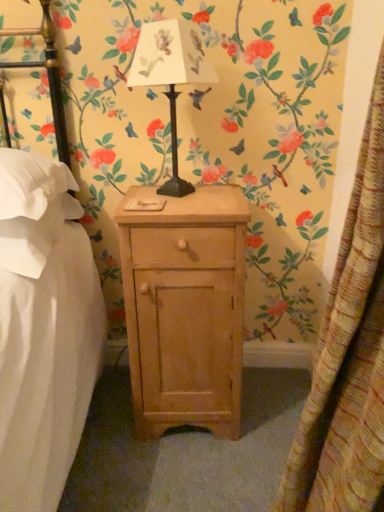
What do you see at coordinates (35, 236) in the screenshot? I see `white fabric pillow at left, acting as the 1th pillow starting from the bottom` at bounding box center [35, 236].

Image resolution: width=384 pixels, height=512 pixels. What do you see at coordinates (348, 356) in the screenshot?
I see `textured yellow curtain at right` at bounding box center [348, 356].

The height and width of the screenshot is (512, 384). What do you see at coordinates (170, 76) in the screenshot?
I see `metallic black table lamp at center` at bounding box center [170, 76].

This screenshot has height=512, width=384. What are the coordinates of `light wood nightstand at center` in the screenshot? It's located at click(185, 308).

Considering the sizes of white fabric pillow at left, the 2th pillow in the top-to-bottom sequence, and metallic black table lamp at center in the image, is white fabric pillow at left, the 2th pillow in the top-to-bottom sequence, bigger or smaller than metallic black table lamp at center?

Considering their sizes, white fabric pillow at left, the 2th pillow in the top-to-bottom sequence, takes up more space than metallic black table lamp at center.

Is white fabric pillow at left, acting as the 1th pillow starting from the bottom, facing away from metallic black table lamp at center?

white fabric pillow at left, acting as the 1th pillow starting from the bottom, does not have its back to metallic black table lamp at center.

Between white fabric pillow at left, the 2th pillow in the top-to-bottom sequence, and metallic black table lamp at center, which one is positioned in front?

Positioned in front is metallic black table lamp at center.

Which point is more distant from viewer, (155,234) or (171,100)?

The point (171,100) is farther from the camera.

Consider the image. Is light wood nightstand at center wider than metallic black table lamp at center?

Yes, light wood nightstand at center is wider than metallic black table lamp at center.

Is light wood nightstand at center positioned with its back to metallic black table lamp at center?

light wood nightstand at center does not have its back to metallic black table lamp at center.

From a real-world perspective, which object stands above the other?

metallic black table lamp at center.

Can you see white fabric pillow at left, acting as the 1th pillow starting from the bottom, touching light wood nightstand at center?

No, white fabric pillow at left, acting as the 1th pillow starting from the bottom, is not making contact with light wood nightstand at center.

Is white fabric pillow at left, the 2th pillow in the top-to-bottom sequence, taller than light wood nightstand at center?

In fact, white fabric pillow at left, the 2th pillow in the top-to-bottom sequence, may be shorter than light wood nightstand at center.

Is white fabric pillow at left, the 2th pillow in the top-to-bottom sequence, oriented towards light wood nightstand at center?

No.

Which of these two, white soft pillow at left, the 2th pillow from the bottom, or textured yellow curtain at right, is wider?

With larger width is white soft pillow at left, the 2th pillow from the bottom.

Looking at this image, does white soft pillow at left, the 2th pillow from the bottom, turn towards textured yellow curtain at right?

No, white soft pillow at left, the 2th pillow from the bottom, does not turn towards textured yellow curtain at right.

Could you measure the distance between white soft pillow at left, the 2th pillow from the bottom, and textured yellow curtain at right?

white soft pillow at left, the 2th pillow from the bottom, and textured yellow curtain at right are 32.49 inches apart from each other.

From the image's perspective, is white soft pillow at left, marked as the 1th pillow in a top-to-bottom arrangement, below textured yellow curtain at right?

Actually, white soft pillow at left, marked as the 1th pillow in a top-to-bottom arrangement, appears above textured yellow curtain at right in the image.

From the image's perspective, who appears lower, white fabric pillow at left, the 2th pillow in the top-to-bottom sequence, or textured yellow curtain at right?

textured yellow curtain at right, from the image's perspective.

Based on their positions, is white fabric pillow at left, acting as the 1th pillow starting from the bottom, located to the left or right of textured yellow curtain at right?

Based on their positions, white fabric pillow at left, acting as the 1th pillow starting from the bottom, is located to the left of textured yellow curtain at right.

Is white fabric pillow at left, acting as the 1th pillow starting from the bottom, oriented away from textured yellow curtain at right?

white fabric pillow at left, acting as the 1th pillow starting from the bottom, is not turned away from textured yellow curtain at right.

In the scene shown: From a real-world perspective, is white fabric pillow at left, acting as the 1th pillow starting from the bottom, located higher than textured yellow curtain at right?

Yes, from a real-world perspective, white fabric pillow at left, acting as the 1th pillow starting from the bottom, is on top of textured yellow curtain at right.

Consider the image. Can you confirm if white soft pillow at left, the 2th pillow from the bottom, is shorter than white fabric pillow at left, acting as the 1th pillow starting from the bottom?

In fact, white soft pillow at left, the 2th pillow from the bottom, may be taller than white fabric pillow at left, acting as the 1th pillow starting from the bottom.

Based on the photo, is white soft pillow at left, the 2th pillow from the bottom, facing away from white fabric pillow at left, the 2th pillow in the top-to-bottom sequence?

No.

Looking at the image, does white soft pillow at left, marked as the 1th pillow in a top-to-bottom arrangement, seem bigger or smaller compared to white fabric pillow at left, acting as the 1th pillow starting from the bottom?

Clearly, white soft pillow at left, marked as the 1th pillow in a top-to-bottom arrangement, is larger in size than white fabric pillow at left, acting as the 1th pillow starting from the bottom.

Is white fabric pillow at left, acting as the 1th pillow starting from the bottom, smaller than white soft pillow at left, the 2th pillow from the bottom?

Correct, white fabric pillow at left, acting as the 1th pillow starting from the bottom, occupies less space than white soft pillow at left, the 2th pillow from the bottom.

From a real-world perspective, is white fabric pillow at left, acting as the 1th pillow starting from the bottom, physically above white soft pillow at left, marked as the 1th pillow in a top-to-bottom arrangement?

No.

Does white fabric pillow at left, acting as the 1th pillow starting from the bottom, turn towards white soft pillow at left, marked as the 1th pillow in a top-to-bottom arrangement?

No.

You are a GUI agent. You are given a task and a screenshot of the screen. Output one action in this format:
    pyautogui.click(x=<x>, y=<y>)
    Task: Click on the table lamp to the right of white fabric pillow at left, the 2th pillow in the top-to-bottom sequence
    The width and height of the screenshot is (384, 512).
    Given the screenshot: What is the action you would take?
    pyautogui.click(x=170, y=76)

Identify the location of table lamp positioned vertically above the light wood nightstand at center (from a real-world perspective). (170, 76).

When comparing their distances from textured yellow curtain at right, does white fabric pillow at left, acting as the 1th pillow starting from the bottom, or white soft pillow at left, the 2th pillow from the bottom, seem further?

white soft pillow at left, the 2th pillow from the bottom, lies further to textured yellow curtain at right than the other object.

Which object lies nearer to the anchor point textured yellow curtain at right, light wood nightstand at center or white fabric pillow at left, acting as the 1th pillow starting from the bottom?

The object closer to textured yellow curtain at right is light wood nightstand at center.

When comparing their distances from white soft pillow at left, the 2th pillow from the bottom, does textured yellow curtain at right or white fabric pillow at left, the 2th pillow in the top-to-bottom sequence, seem further?

Based on the image, textured yellow curtain at right appears to be further to white soft pillow at left, the 2th pillow from the bottom.

When comparing their distances from textured yellow curtain at right, does white soft pillow at left, the 2th pillow from the bottom, or white fabric pillow at left, acting as the 1th pillow starting from the bottom, seem further?

The object further to textured yellow curtain at right is white soft pillow at left, the 2th pillow from the bottom.

Looking at the image, which one is located closer to light wood nightstand at center, white fabric pillow at left, acting as the 1th pillow starting from the bottom, or white soft pillow at left, the 2th pillow from the bottom?

white fabric pillow at left, acting as the 1th pillow starting from the bottom, lies closer to light wood nightstand at center than the other object.

Estimate the real-world distances between objects in this image. Which object is closer to white soft pillow at left, the 2th pillow from the bottom, light wood nightstand at center or white fabric pillow at left, the 2th pillow in the top-to-bottom sequence?

Among the two, white fabric pillow at left, the 2th pillow in the top-to-bottom sequence, is located nearer to white soft pillow at left, the 2th pillow from the bottom.

From the picture: Estimate the real-world distances between objects in this image. Which object is further from textured yellow curtain at right, white fabric pillow at left, the 2th pillow in the top-to-bottom sequence, or light wood nightstand at center?

Based on the image, white fabric pillow at left, the 2th pillow in the top-to-bottom sequence, appears to be further to textured yellow curtain at right.

When comparing their distances from metallic black table lamp at center, does textured yellow curtain at right or white fabric pillow at left, the 2th pillow in the top-to-bottom sequence, seem closer?

Based on the image, white fabric pillow at left, the 2th pillow in the top-to-bottom sequence, appears to be nearer to metallic black table lamp at center.

This screenshot has width=384, height=512. I want to click on table lamp between textured yellow curtain at right and white fabric pillow at left, the 2th pillow in the top-to-bottom sequence, along the z-axis, so click(x=170, y=76).

Where is `table lamp between textured yellow curtain at right and light wood nightstand at center along the z-axis`? The image size is (384, 512). table lamp between textured yellow curtain at right and light wood nightstand at center along the z-axis is located at coordinates (170, 76).

The height and width of the screenshot is (512, 384). I want to click on pillow located between white fabric pillow at left, the 2th pillow in the top-to-bottom sequence, and light wood nightstand at center in the left-right direction, so click(34, 185).

The width and height of the screenshot is (384, 512). Find the location of `pillow between textured yellow curtain at right and metallic black table lamp at center along the z-axis`. pillow between textured yellow curtain at right and metallic black table lamp at center along the z-axis is located at coordinates [x=34, y=185].